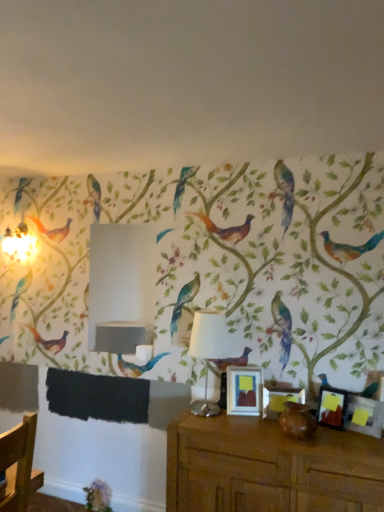
Question: Does matte wooden picture frame at center, which appears as the third picture frame when viewed from the right, have a lesser height compared to matte black picture frame at right, placed as the third picture frame when sorted from left to right?

Choices:
 (A) no
 (B) yes

Answer: (B)

Question: Is matte wooden picture frame at center, which appears as the third picture frame when viewed from the right, at the left side of matte black picture frame at right, placed as the third picture frame when sorted from left to right?

Choices:
 (A) no
 (B) yes

Answer: (B)

Question: Does matte wooden picture frame at center, which appears as the third picture frame when viewed from the right, have a lesser width compared to matte black picture frame at right, which ranks as the 2th picture frame in right-to-left order?

Choices:
 (A) yes
 (B) no

Answer: (A)

Question: Is matte wooden picture frame at center, the second picture frame viewed from the left, positioned with its back to matte black picture frame at right, placed as the third picture frame when sorted from left to right?

Choices:
 (A) no
 (B) yes

Answer: (A)

Question: From the image's perspective, is matte wooden picture frame at center, the second picture frame viewed from the left, below matte black picture frame at right, placed as the third picture frame when sorted from left to right?

Choices:
 (A) yes
 (B) no

Answer: (A)

Question: Is matte black picture frame at right, placed as the third picture frame when sorted from left to right, a part of matte wooden picture frame at center, the second picture frame viewed from the left?

Choices:
 (A) no
 (B) yes

Answer: (A)

Question: Does matte black picture frame at lower right, the 1th picture frame from the right, have a greater width compared to matte wooden picture frame at center, which appears as the third picture frame when viewed from the right?

Choices:
 (A) yes
 (B) no

Answer: (B)

Question: Would you say matte black picture frame at lower right, the 1th picture frame from the right, contains matte wooden picture frame at center, which appears as the third picture frame when viewed from the right?

Choices:
 (A) yes
 (B) no

Answer: (B)

Question: Considering the relative positions of matte black picture frame at lower right, the fourth picture frame in the left-to-right sequence, and matte wooden picture frame at center, the second picture frame viewed from the left, in the image provided, is matte black picture frame at lower right, the fourth picture frame in the left-to-right sequence, behind matte wooden picture frame at center, the second picture frame viewed from the left,?

Choices:
 (A) yes
 (B) no

Answer: (B)

Question: Can you confirm if matte black picture frame at lower right, the 1th picture frame from the right, is taller than matte wooden picture frame at center, which appears as the third picture frame when viewed from the right?

Choices:
 (A) no
 (B) yes

Answer: (B)

Question: Is matte black picture frame at lower right, the 1th picture frame from the right, aimed at matte wooden picture frame at center, the second picture frame viewed from the left?

Choices:
 (A) yes
 (B) no

Answer: (B)

Question: Can you confirm if matte black picture frame at lower right, the fourth picture frame in the left-to-right sequence, is shorter than matte wooden picture frame at center, the second picture frame viewed from the left?

Choices:
 (A) no
 (B) yes

Answer: (A)

Question: Is the position of brown matte vase at lower center more distant than that of matte black picture frame at right, which ranks as the 2th picture frame in right-to-left order?

Choices:
 (A) no
 (B) yes

Answer: (A)